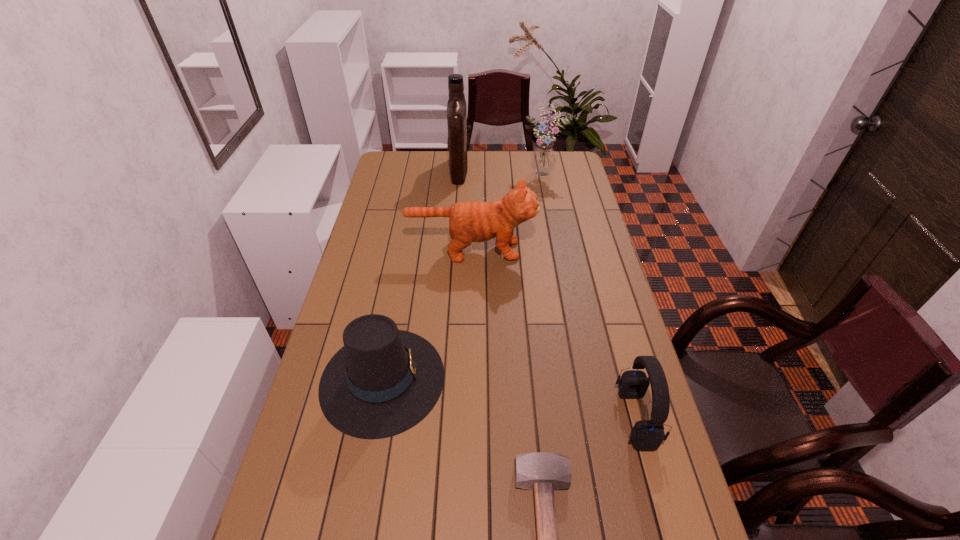
At what (x,y) coordinates should I click in order to perform the action: click on vacant area situated on the headband of the headset. Please return your answer as a coordinate pair (x, y). This screenshot has width=960, height=540. Looking at the image, I should click on (600, 417).

The image size is (960, 540). In order to click on vacant position located 0.400m on the headband of the headset in this screenshot , I will do `click(464, 417)`.

Where is `free region located on the headband of the headset`? The height and width of the screenshot is (540, 960). free region located on the headband of the headset is located at coordinates (475, 417).

The image size is (960, 540). Find the location of `liquor that is at the far edge`. liquor that is at the far edge is located at coordinates (456, 106).

This screenshot has height=540, width=960. Find the location of `bouquet at the far edge`. bouquet at the far edge is located at coordinates (543, 161).

Identify the location of object present at the left edge. (384, 381).

In order to click on bouquet that is at the right edge in this screenshot , I will do `click(543, 161)`.

This screenshot has width=960, height=540. Identify the location of headset that is at the right edge. (647, 435).

Where is `object that is at the far right corner`? This screenshot has height=540, width=960. object that is at the far right corner is located at coordinates (543, 161).

Where is `free space at the far edge of the desktop`? This screenshot has height=540, width=960. free space at the far edge of the desktop is located at coordinates (484, 157).